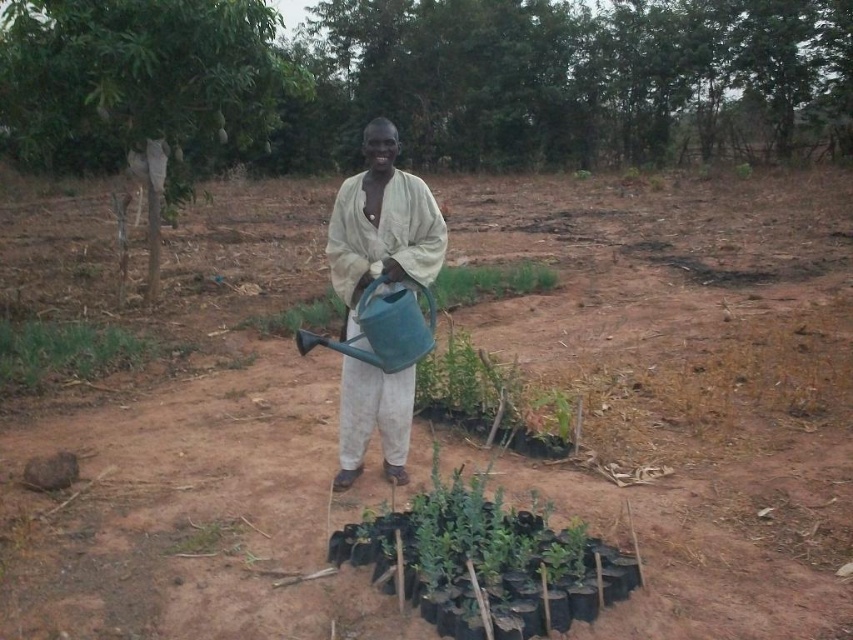
In the scene shown: You are a farmer who wants to plant a new row of saplings between the brown soil at center and the green leafy tree at upper left. Which area should you choose to ensure the saplings have enough space to grow?

The green leafy tree at upper left is larger than the brown soil at center, so planting between them would require considering the space. Since the brown soil at center is smaller, the area near the green leafy tree at upper left might offer more space for the saplings to grow properly.

You are a gardener standing in a rural area holding a green watering can. You notice brown soil at center and a green leafy tree at upper left. Which object is positioned to the right of the other?

The brown soil at center is to the right of the green leafy tree at upper left.

You are a drone operator trying to capture a photo of the brown soil at center and the light beige fabric shirt at center. Which object should you focus on first to ensure both are in the frame without moving the camera?

The brown soil at center is closer to the viewer than the light beige fabric shirt at center, so you should focus on the brown soil at center first to ensure both are in focus and within the frame.